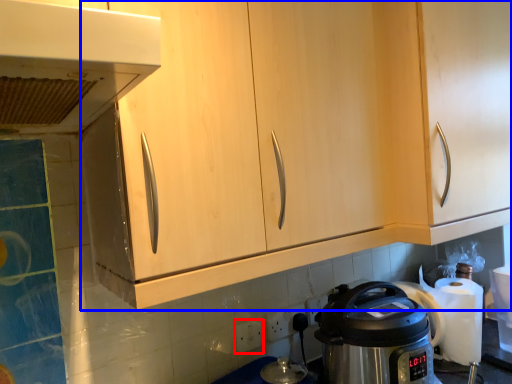
Question: Which point is further to the camera, electric outlet (highlighted by a red box) or cabinetry (highlighted by a blue box)?

Choices:
 (A) electric outlet
 (B) cabinetry

Answer: (A)